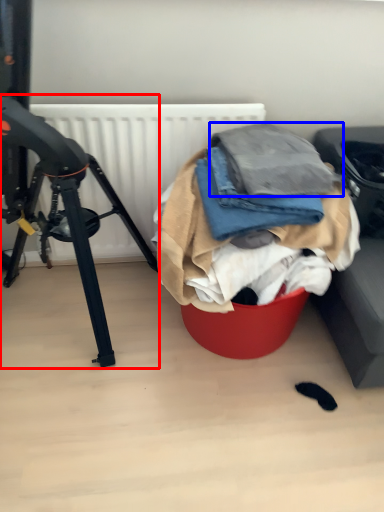
Question: Which of the following is the closest to the observer, tripod (highlighted by a red box) or clothing (highlighted by a blue box)?

Choices:
 (A) tripod
 (B) clothing

Answer: (A)